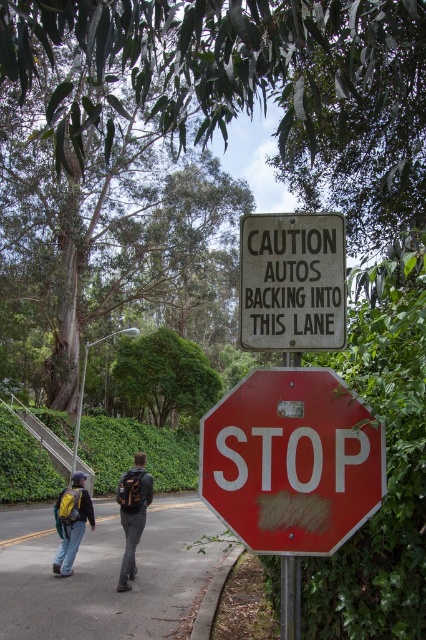
Which is more to the right, gray asphalt pavement at lower center or green leafy hedge at lower center?

gray asphalt pavement at lower center

Between gray asphalt pavement at lower center and green leafy hedge at lower center, which one is positioned lower?

green leafy hedge at lower center

Between point (138, 557) and point (78, 456), which one is positioned in front?

Positioned in front is point (138, 557).

This screenshot has height=640, width=426. I want to click on gray asphalt pavement at lower center, so click(x=106, y=573).

Which is more to the right, gray asphalt pavement at lower center or green leafy hedge at upper center?

Result: gray asphalt pavement at lower center

Is point (167, 538) positioned after point (175, 333)?

That is False.

Where is `gray asphalt pavement at lower center`? gray asphalt pavement at lower center is located at coordinates (106, 573).

Does smooth red stop sign at center lie in front of green leafy hedge at lower center?

Yes.

Is smooth red stop sign at center thinner than green leafy hedge at lower center?

Indeed, smooth red stop sign at center has a lesser width compared to green leafy hedge at lower center.

Is point (230, 525) positioned behind point (196, 465)?

No, it is in front of (196, 465).

Identify the location of smooth red stop sign at center. The width and height of the screenshot is (426, 640). (291, 461).